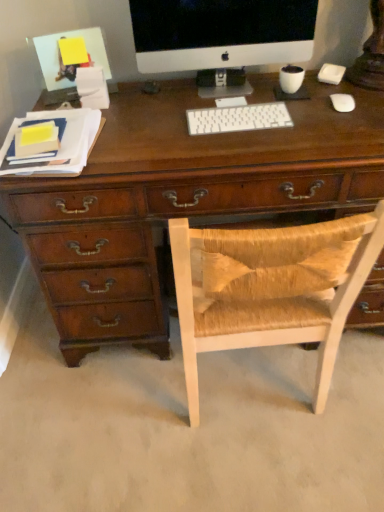
Question: Is woven wood chair at center a part of white matte mouse at right?

Choices:
 (A) no
 (B) yes

Answer: (A)

Question: Does white matte mouse at right have a greater height compared to woven wood chair at center?

Choices:
 (A) no
 (B) yes

Answer: (A)

Question: Is white matte mouse at right positioned beyond the bounds of woven wood chair at center?

Choices:
 (A) yes
 (B) no

Answer: (A)

Question: Considering the relative sizes of white matte mouse at right and woven wood chair at center in the image provided, is white matte mouse at right shorter than woven wood chair at center?

Choices:
 (A) yes
 (B) no

Answer: (A)

Question: Is white matte mouse at right thinner than woven wood chair at center?

Choices:
 (A) yes
 (B) no

Answer: (A)

Question: From the image's perspective, is white plastic keyboard at center above or below woven wood chair at center?

Choices:
 (A) above
 (B) below

Answer: (A)

Question: Considering the positions of point (246, 115) and point (281, 323), is point (246, 115) closer or farther from the camera than point (281, 323)?

Choices:
 (A) farther
 (B) closer

Answer: (A)

Question: From their relative heights in the image, would you say white plastic keyboard at center is taller or shorter than woven wood chair at center?

Choices:
 (A) short
 (B) tall

Answer: (A)

Question: In the image, is white plastic keyboard at center on the left side or the right side of woven wood chair at center?

Choices:
 (A) left
 (B) right

Answer: (A)

Question: From a real-world perspective, is woven wood chair at center above or below white plastic keyboard at center?

Choices:
 (A) below
 (B) above

Answer: (A)

Question: In the image, is woven wood chair at center on the left side or the right side of white plastic keyboard at center?

Choices:
 (A) right
 (B) left

Answer: (A)

Question: Looking at their shapes, would you say woven wood chair at center is wider or thinner than white plastic keyboard at center?

Choices:
 (A) wide
 (B) thin

Answer: (A)

Question: Is point (281, 246) positioned closer to the camera than point (190, 115)?

Choices:
 (A) closer
 (B) farther

Answer: (A)

Question: Considering the positions of white plastic keyboard at center and white matte mouse at right in the image, is white plastic keyboard at center bigger or smaller than white matte mouse at right?

Choices:
 (A) small
 (B) big

Answer: (B)

Question: Relative to white matte mouse at right, is white plastic keyboard at center in front or behind?

Choices:
 (A) behind
 (B) front

Answer: (B)